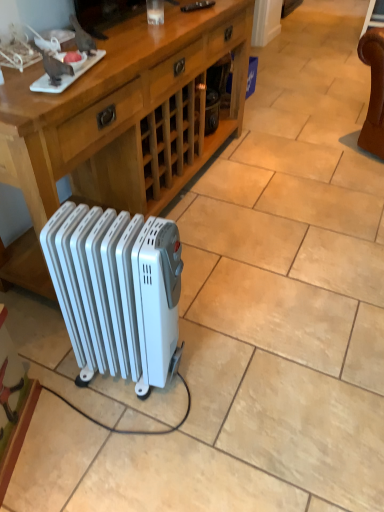
Image resolution: width=384 pixels, height=512 pixels. In order to click on free spot above white plastic radiator at lower center (from a real-world perspective) in this screenshot , I will do `click(114, 226)`.